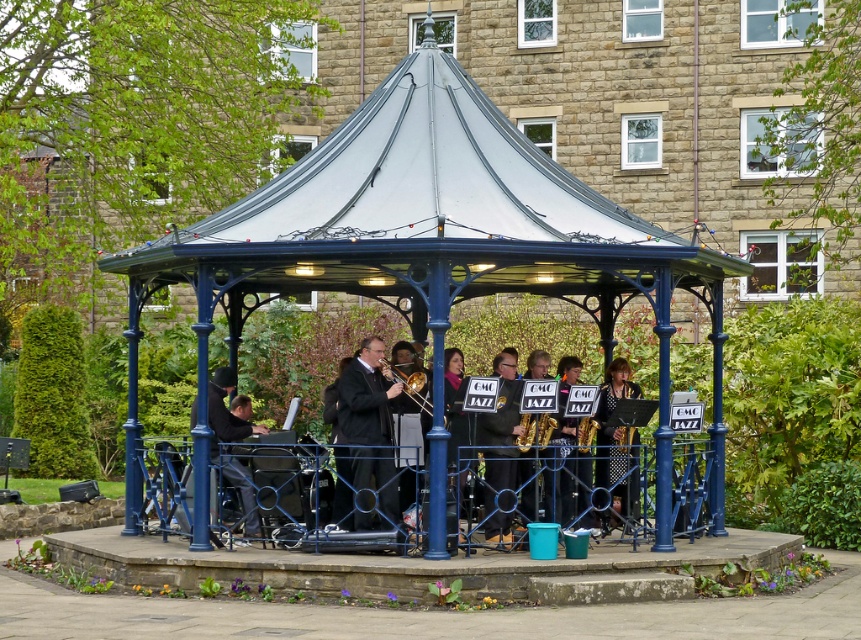
Question: Which object appears closest to the camera in this image?

Choices:
 (A) satin gold saxophone at center
 (B) black leather jacket at center
 (C) polka dot dress at center
 (D) black satin suit at center

Answer: (B)

Question: Estimate the real-world distances between objects in this image. Which object is closer to the black satin suit at center?

Choices:
 (A) dark blue fabric piano at lower left
 (B) metallic blue gazebo at center
 (C) gold brass trombone at center

Answer: (C)

Question: Can you confirm if polka dot dress at center is thinner than gold brass trombone at center?

Choices:
 (A) no
 (B) yes

Answer: (A)

Question: Considering the relative positions of metallic blue gazebo at center and gold brass trombone at center in the image provided, where is metallic blue gazebo at center located with respect to gold brass trombone at center?

Choices:
 (A) right
 (B) left

Answer: (A)

Question: Is gold metallic saxophone at center to the right of satin gold saxophone at center from the viewer's perspective?

Choices:
 (A) no
 (B) yes

Answer: (A)

Question: Which object is positioned farthest from the satin gold saxophone at center?

Choices:
 (A) dark blue fabric piano at lower left
 (B) polka dot dress at center
 (C) shiny black saxophone at center
 (D) gold metallic saxophone at center

Answer: (A)